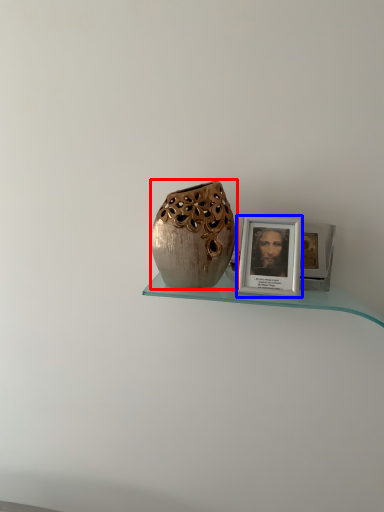
Question: Which object appears farthest to the camera in this image, vase (highlighted by a red box) or picture frame (highlighted by a blue box)?

Choices:
 (A) vase
 (B) picture frame

Answer: (B)